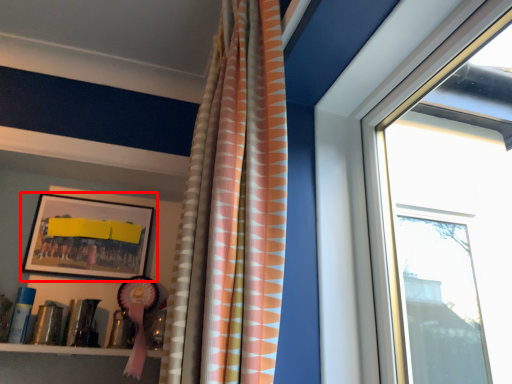
Question: From the image's perspective, what is the correct spatial positioning of picture frame (annotated by the red box) in reference to curtain?

Choices:
 (A) above
 (B) below

Answer: (B)